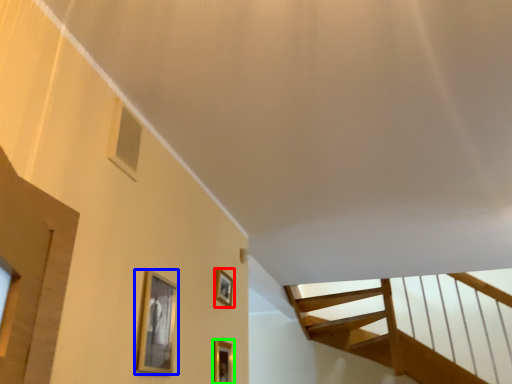
Question: Considering the real-world distances, which object is farthest from picture frame (highlighted by a red box)? picture frame (highlighted by a blue box) or picture frame (highlighted by a green box)?

Choices:
 (A) picture frame
 (B) picture frame

Answer: (A)